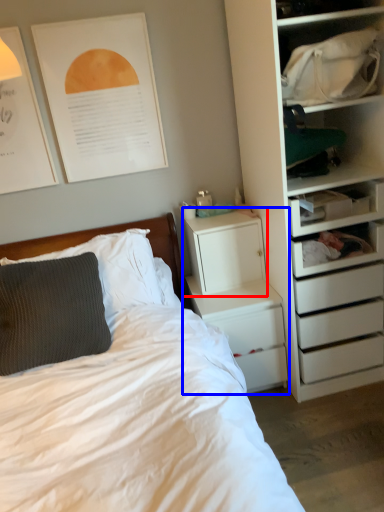
Question: Which object appears closest to the camera in this image, file cabinet (highlighted by a red box) or nightstand (highlighted by a blue box)?

Choices:
 (A) file cabinet
 (B) nightstand

Answer: (B)